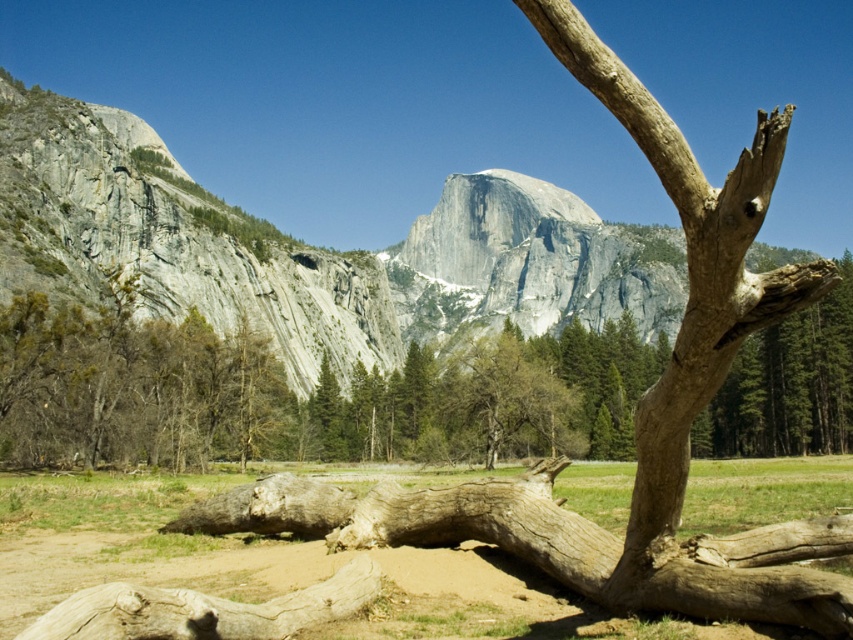
Who is more distant from viewer, (328, 522) or (289, 611)?

Point (328, 522)

Does brown dirt field at lower center have a lesser height compared to brown rough log at lower left?

No, brown dirt field at lower center is not shorter than brown rough log at lower left.

Describe the element at coordinates (404, 560) in the screenshot. The width and height of the screenshot is (853, 640). I see `brown dirt field at lower center` at that location.

Locate an element on the screen. The image size is (853, 640). brown dirt field at lower center is located at coordinates (404, 560).